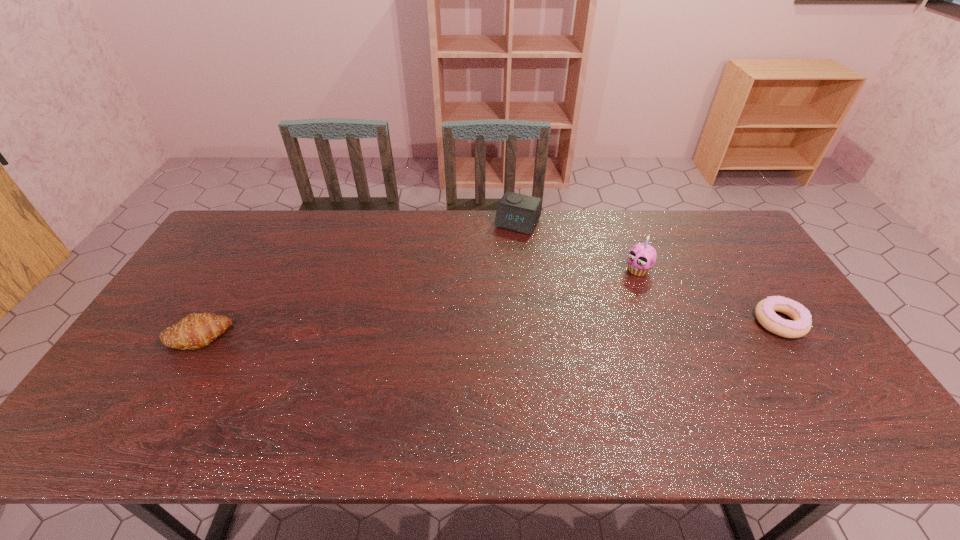
What are the coordinates of `vacant area located 0.090m on the face of the tallest object` in the screenshot? It's located at (612, 291).

At what (x,y) coordinates should I click in order to perform the action: click on vacant point located on the face of the tallest object. Please return your answer as a coordinate pair (x, y). This screenshot has height=540, width=960. Looking at the image, I should click on (618, 286).

At what (x,y) coordinates should I click in order to perform the action: click on vacant area situated on the face of the tallest object. Please return your answer as a coordinate pair (x, y). This screenshot has width=960, height=540. Looking at the image, I should click on (585, 314).

Where is `vacant space located 0.320m on the front-facing side of the third shortest object`? vacant space located 0.320m on the front-facing side of the third shortest object is located at coordinates (476, 296).

Where is `free spot located 0.200m on the front-facing side of the third shortest object`? This screenshot has width=960, height=540. free spot located 0.200m on the front-facing side of the third shortest object is located at coordinates (491, 271).

Image resolution: width=960 pixels, height=540 pixels. I want to click on vacant space situated on the front-facing side of the third shortest object, so click(500, 254).

Where is `object positioned at the far edge`? The width and height of the screenshot is (960, 540). object positioned at the far edge is located at coordinates (516, 212).

Find the location of a particular element. object that is at the left edge is located at coordinates (195, 331).

Where is `object that is at the right edge`? object that is at the right edge is located at coordinates (800, 326).

Locate an element on the screen. The height and width of the screenshot is (540, 960). vacant space at the far edge is located at coordinates (496, 249).